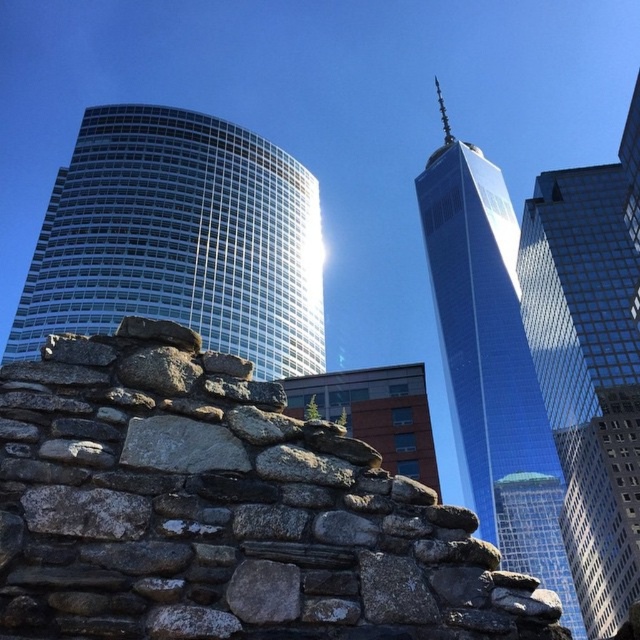
Who is taller, white glass building at left or shiny glass skyscraper at center?

shiny glass skyscraper at center is taller.

Where is `white glass building at left`? This screenshot has height=640, width=640. white glass building at left is located at coordinates (179, 240).

Does gray rough stone wall at center have a greater height compared to glassy blue skyscraper at center?

No.

Between gray rough stone wall at center and glassy blue skyscraper at center, which one is positioned lower?

glassy blue skyscraper at center is lower down.

This screenshot has height=640, width=640. I want to click on gray rough stone wall at center, so click(x=221, y=512).

Image resolution: width=640 pixels, height=640 pixels. In order to click on gray rough stone wall at center in this screenshot , I will do `click(221, 512)`.

Can you confirm if gray rough stone wall at center is positioned below shiny glass skyscraper at center?

Yes, gray rough stone wall at center is below shiny glass skyscraper at center.

Does point (518, 627) come closer to viewer compared to point (490, 360)?

That is True.

Between point (74, 563) and point (512, 545), which one is positioned behind?

The point (512, 545) is behind.

Where is `gray rough stone wall at center`? gray rough stone wall at center is located at coordinates (221, 512).